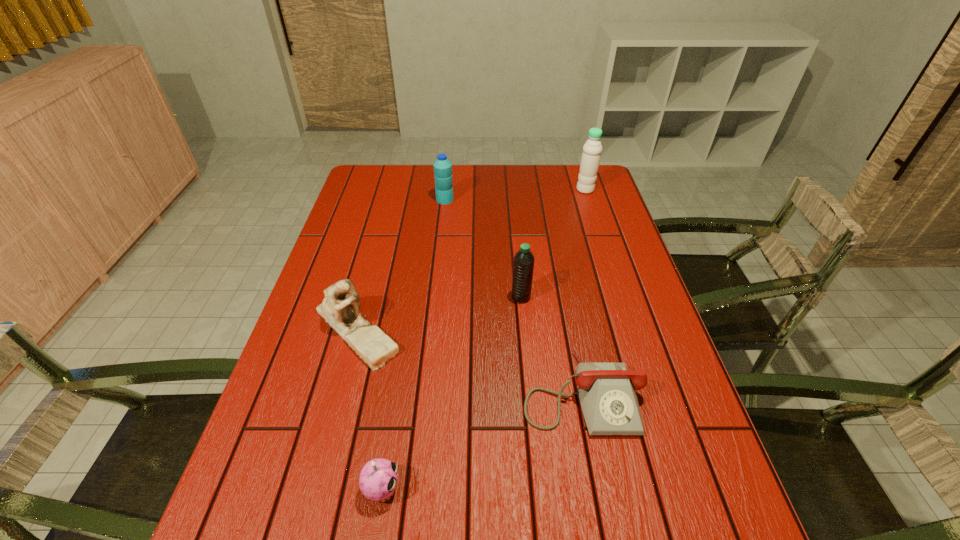
Locate an element on the screen. The width and height of the screenshot is (960, 540). vacant position located on the right of the nearest water bottle is located at coordinates (570, 297).

In order to click on free space located 0.380m on the front of the second farthest object in this screenshot , I will do `click(437, 278)`.

This screenshot has width=960, height=540. I want to click on free region located 0.250m on the front-facing side of the figurine, so click(317, 478).

Locate an element on the screen. vacant space located on the face of the fifth tallest object is located at coordinates [x=468, y=489].

Image resolution: width=960 pixels, height=540 pixels. In order to click on free space located 0.180m on the dial of the telephone in this screenshot , I will do `click(608, 533)`.

This screenshot has width=960, height=540. I want to click on object located in the left edge section of the desktop, so click(x=340, y=308).

Where is `water bottle that is at the right edge`? water bottle that is at the right edge is located at coordinates (592, 149).

I want to click on telephone that is at the right edge, so click(x=607, y=394).

Where is `object at the far right corner`? object at the far right corner is located at coordinates (592, 149).

Identify the location of blank space at the far edge of the desktop. (485, 180).